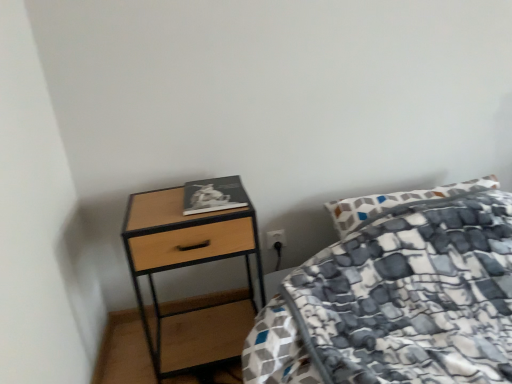
Question: Is matte black book at upper left not inside woodenmaterial/texturenightstand at left?

Choices:
 (A) no
 (B) yes

Answer: (B)

Question: Considering the relative positions of matte black book at upper left and woodenmaterial/texturenightstand at left in the image provided, is matte black book at upper left to the left of woodenmaterial/texturenightstand at left from the viewer's perspective?

Choices:
 (A) yes
 (B) no

Answer: (B)

Question: Can you confirm if matte black book at upper left is taller than woodenmaterial/texturenightstand at left?

Choices:
 (A) no
 (B) yes

Answer: (A)

Question: Considering the relative positions of matte black book at upper left and woodenmaterial/texturenightstand at left in the image provided, is matte black book at upper left behind woodenmaterial/texturenightstand at left?

Choices:
 (A) yes
 (B) no

Answer: (A)

Question: From the image's perspective, does matte black book at upper left appear higher than woodenmaterial/texturenightstand at left?

Choices:
 (A) no
 (B) yes

Answer: (B)

Question: From a real-world perspective, does matte black book at upper left stand above woodenmaterial/texturenightstand at left?

Choices:
 (A) yes
 (B) no

Answer: (A)

Question: Considering the relative sizes of woodenmaterial/texturenightstand at left and matte black book at upper left in the image provided, is woodenmaterial/texturenightstand at left taller than matte black book at upper left?

Choices:
 (A) no
 (B) yes

Answer: (B)

Question: Considering the relative sizes of woodenmaterial/texturenightstand at left and matte black book at upper left in the image provided, is woodenmaterial/texturenightstand at left wider than matte black book at upper left?

Choices:
 (A) yes
 (B) no

Answer: (A)

Question: From the image's perspective, is woodenmaterial/texturenightstand at left below matte black book at upper left?

Choices:
 (A) yes
 (B) no

Answer: (A)

Question: Is woodenmaterial/texturenightstand at left far away from matte black book at upper left?

Choices:
 (A) yes
 (B) no

Answer: (B)

Question: Does woodenmaterial/texturenightstand at left appear on the left side of matte black book at upper left?

Choices:
 (A) yes
 (B) no

Answer: (A)

Question: From a real-world perspective, is woodenmaterial/texturenightstand at left located beneath matte black book at upper left?

Choices:
 (A) yes
 (B) no

Answer: (A)

Question: In the image, is woodenmaterial/texturenightstand at left on the left side or the right side of matte black book at upper left?

Choices:
 (A) left
 (B) right

Answer: (A)